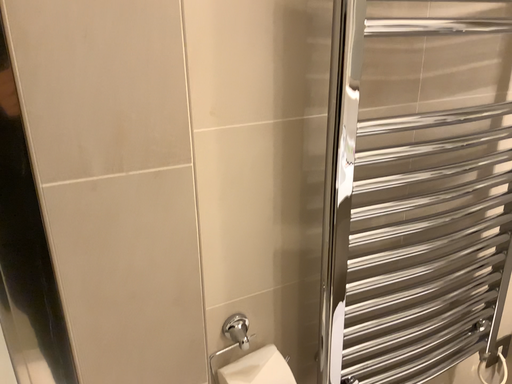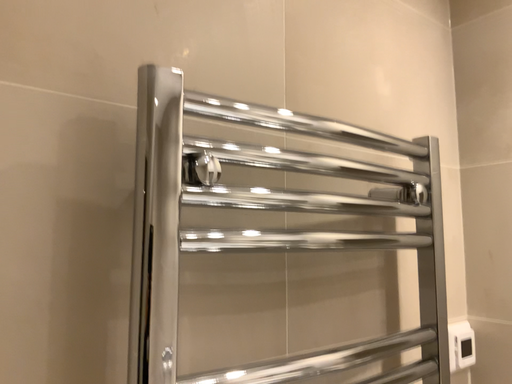
Question: Which way did the camera rotate in the video?

Choices:
 (A) rotated upward
 (B) rotated downward

Answer: (A)